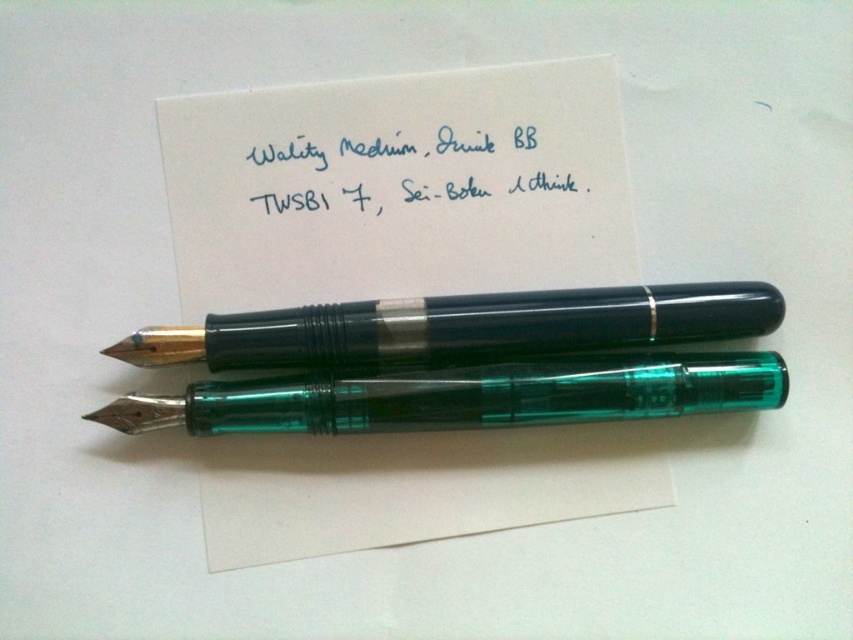
Question: Is transparent green pen at center further to the viewer compared to blue ink writing at upper center?

Choices:
 (A) yes
 (B) no

Answer: (B)

Question: Can you confirm if black translucent pen at center is positioned to the right of transparent green pen at center?

Choices:
 (A) yes
 (B) no

Answer: (A)

Question: Which object is the farthest from the white paper at center?

Choices:
 (A) transparent green pen at center
 (B) blue ink writing at upper center
 (C) black translucent pen at center

Answer: (A)

Question: Which point is farther to the camera?

Choices:
 (A) blue ink writing at upper center
 (B) transparent green pen at center
 (C) white paper at center

Answer: (A)

Question: Is black translucent pen at center positioned before transparent green pen at center?

Choices:
 (A) yes
 (B) no

Answer: (B)

Question: Considering the real-world distances, which object is farthest from the black translucent pen at center?

Choices:
 (A) transparent green pen at center
 (B) white paper at center
 (C) blue ink writing at upper center

Answer: (C)